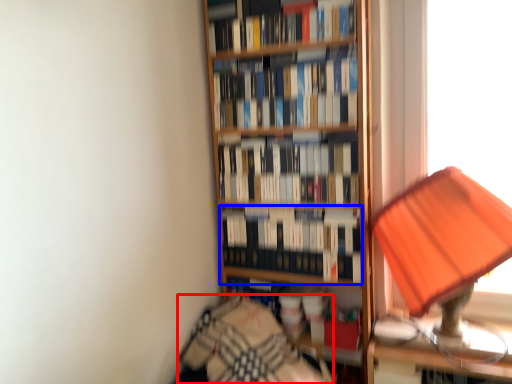
Question: Which point is further to the camera, bedding (highlighted by a red box) or book (highlighted by a blue box)?

Choices:
 (A) bedding
 (B) book

Answer: (B)